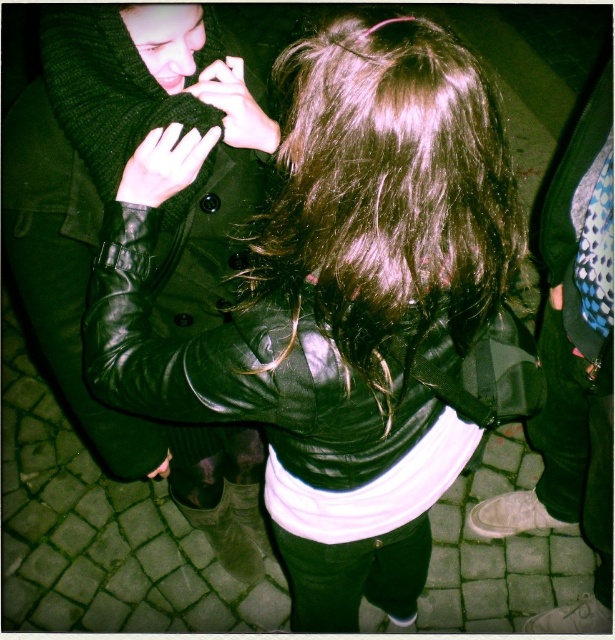
Question: Does leather jacket at center have a smaller size compared to matte black hand at lower left?

Choices:
 (A) no
 (B) yes

Answer: (A)

Question: Is shiny brown hair at center further to camera compared to matte black glove at upper center?

Choices:
 (A) yes
 (B) no

Answer: (B)

Question: Among these objects, which one is nearest to the camera?

Choices:
 (A) leather jacket at center
 (B) matte black hand at center
 (C) matte black hand at lower left
 (D) matte black glove at upper center

Answer: (A)

Question: Which object is the closest to the matte black hand at lower left?

Choices:
 (A) leather jacket at center
 (B) matte black hand at center
 (C) shiny black leather jacket at center

Answer: (C)

Question: Which point is farther to the camera?

Choices:
 (A) (153, 476)
 (B) (462, 333)
 (C) (194, 92)
 (D) (506, 356)

Answer: (A)

Question: Does leather jacket at center appear on the right side of shiny black leather jacket at center?

Choices:
 (A) yes
 (B) no

Answer: (A)